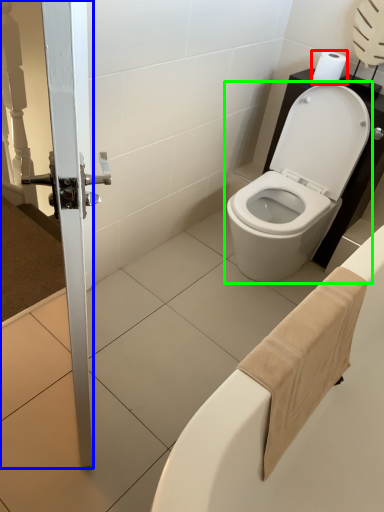
Question: Which object is positioned farthest from toilet paper (highlighted by a red box)? Select from screen door (highlighted by a blue box) and toilet (highlighted by a green box).

Choices:
 (A) screen door
 (B) toilet

Answer: (A)